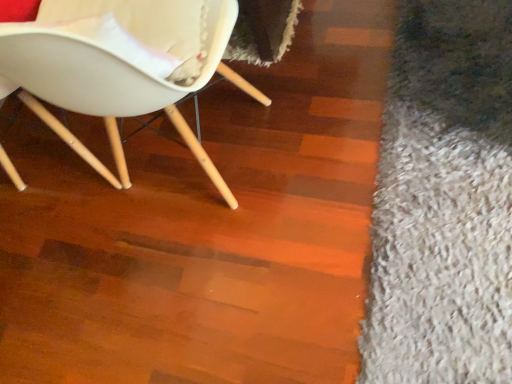
Find the location of a particular element. Image resolution: width=512 pixels, height=384 pixels. free space in front of white matte plastic chair at upper left is located at coordinates (252, 270).